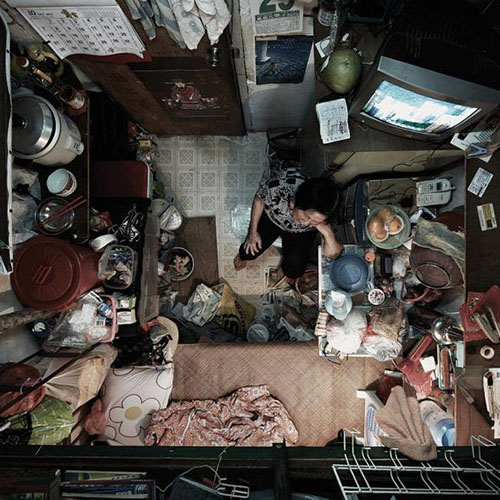
You are a GUI agent. You are given a task and a screenshot of the screen. Output one action in this format:
    pyautogui.click(x=<x>, y=<y>)
    Task: Click on the tv screen
    The height and width of the screenshot is (500, 500).
    Given the screenshot: What is the action you would take?
    pyautogui.click(x=418, y=107)